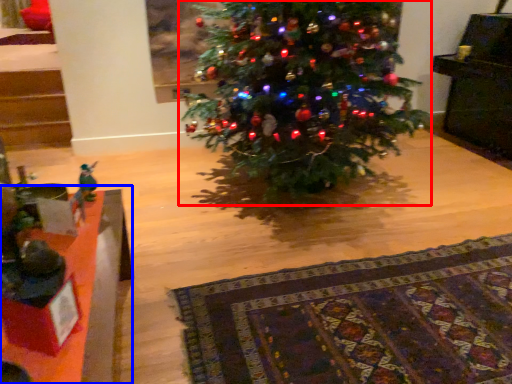
Question: Which of the following is the farthest to the observer, christmas tree (highlighted by a red box) or table (highlighted by a blue box)?

Choices:
 (A) christmas tree
 (B) table

Answer: (A)